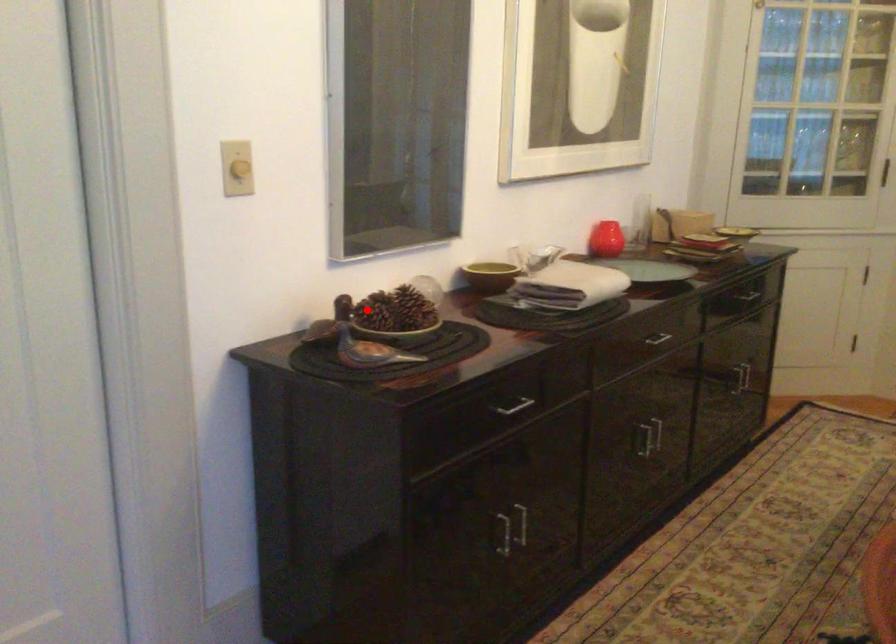
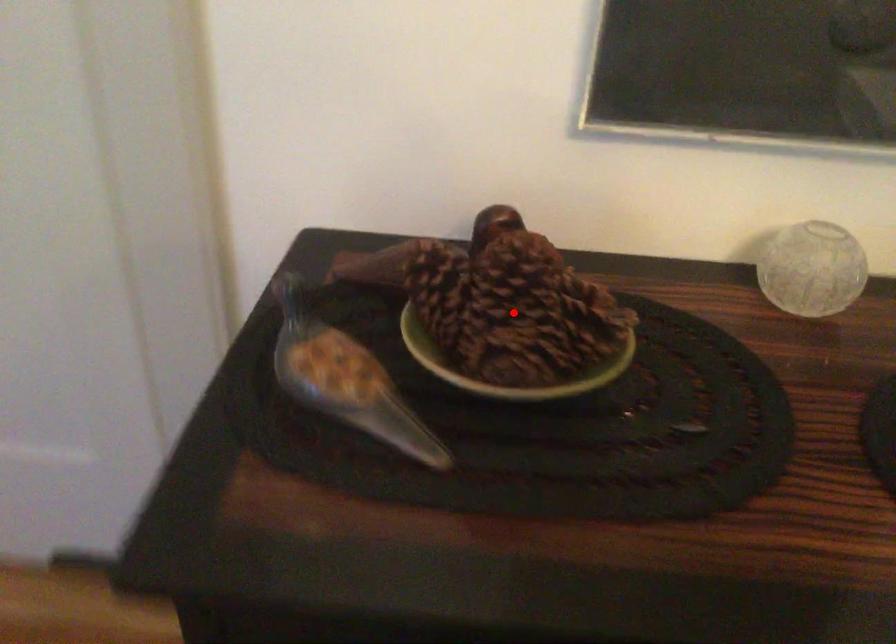
I am providing you with two images of the same scene from different viewpoints. A red point is marked on the first image and another point is marked on the second image. Are the points marked in image1 and image2 representing the same 3D position?

No